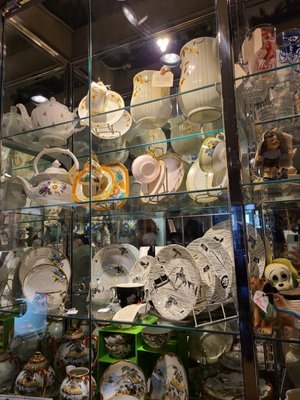
Find any where you'd hold the teapots in the picture. Your answer should be formatted as a list of tuples, i.e. [(x1, y1), (x2, y2), ...], where each tuple contains the x and y coordinates of a point satisfying the conditions above.

[(66, 151), (75, 108)]